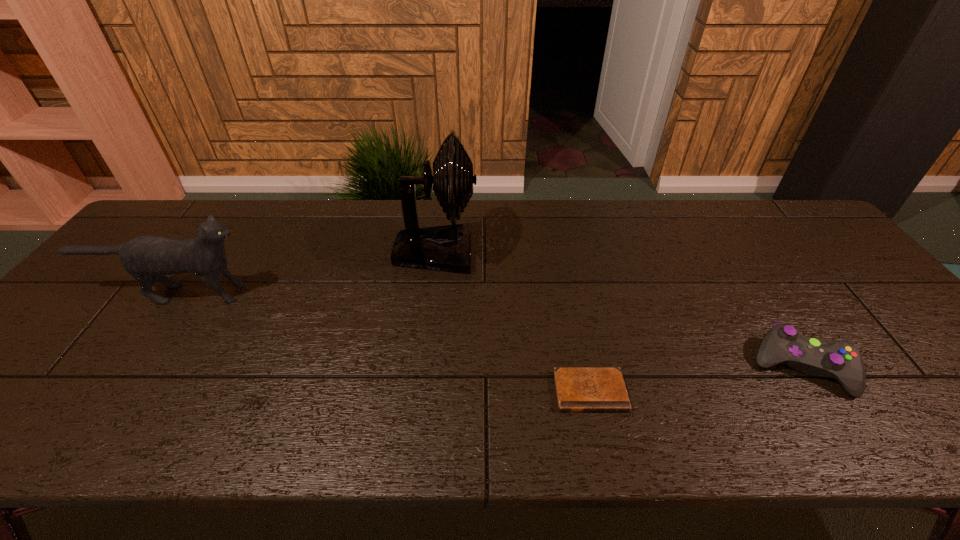
Where is `free space located 0.320m on the back of the control`? free space located 0.320m on the back of the control is located at coordinates (728, 253).

The height and width of the screenshot is (540, 960). Find the location of `object positioned at the far edge`. object positioned at the far edge is located at coordinates (446, 247).

Identify the location of object that is at the near edge. (578, 389).

The image size is (960, 540). In order to click on object present at the left edge in this screenshot , I will do `click(147, 258)`.

At what (x,y) coordinates should I click in order to perform the action: click on free space at the far edge of the desktop. Please return your answer as a coordinate pair (x, y). The width and height of the screenshot is (960, 540). Looking at the image, I should click on click(x=278, y=210).

Locate an element on the screen. Image resolution: width=960 pixels, height=540 pixels. free space at the near edge of the desktop is located at coordinates (91, 407).

This screenshot has width=960, height=540. In order to click on vacant area at the left edge in this screenshot , I will do `click(7, 384)`.

I want to click on vacant region at the right edge of the desktop, so click(x=804, y=252).

This screenshot has width=960, height=540. I want to click on vacant space at the far right corner of the desktop, so click(822, 232).

You are a GUI agent. You are given a task and a screenshot of the screen. Output one action in this format:
    pyautogui.click(x=<x>, y=<y>)
    Task: Click on the vacant space in between the tallest object and the control
    The image size is (960, 540).
    Given the screenshot: What is the action you would take?
    coord(618,309)